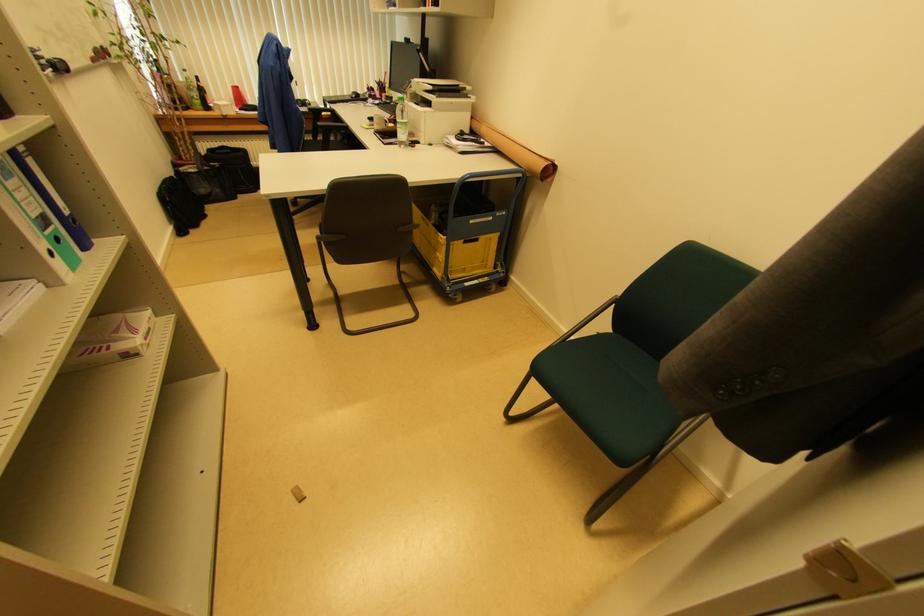
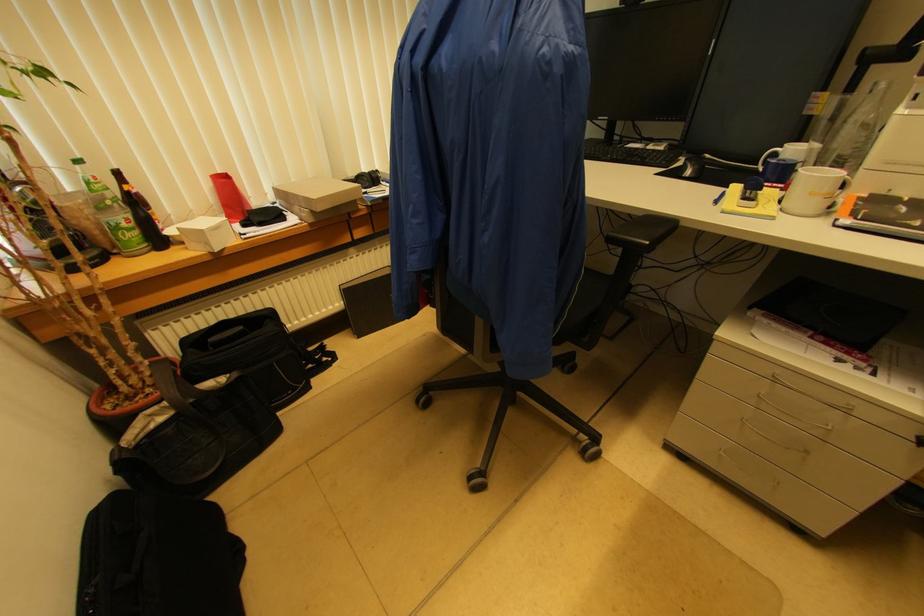
The point at (199, 79) is marked in the first image. Where is the corresponding point in the second image?

(118, 176)